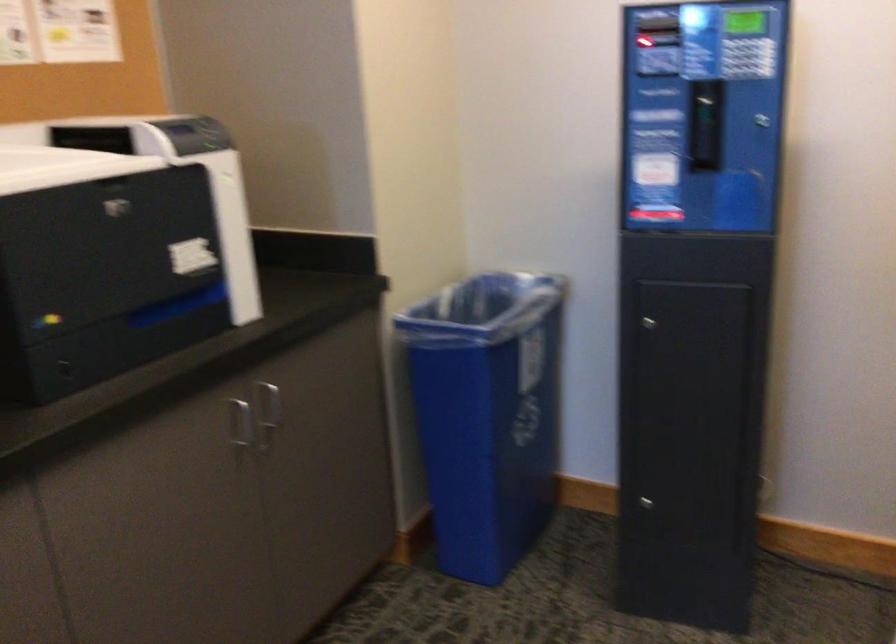
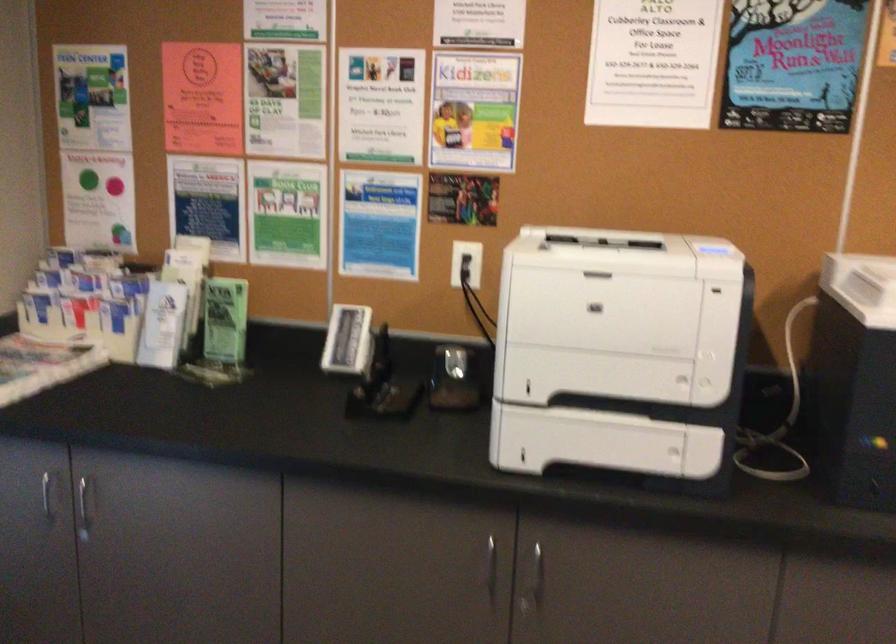
Question: Based on the continuous images, in which direction is the camera rotating? Reply with the corresponding letter.

Choices:
 (A) Left
 (B) Right
 (C) Up
 (D) Down

Answer: (A)